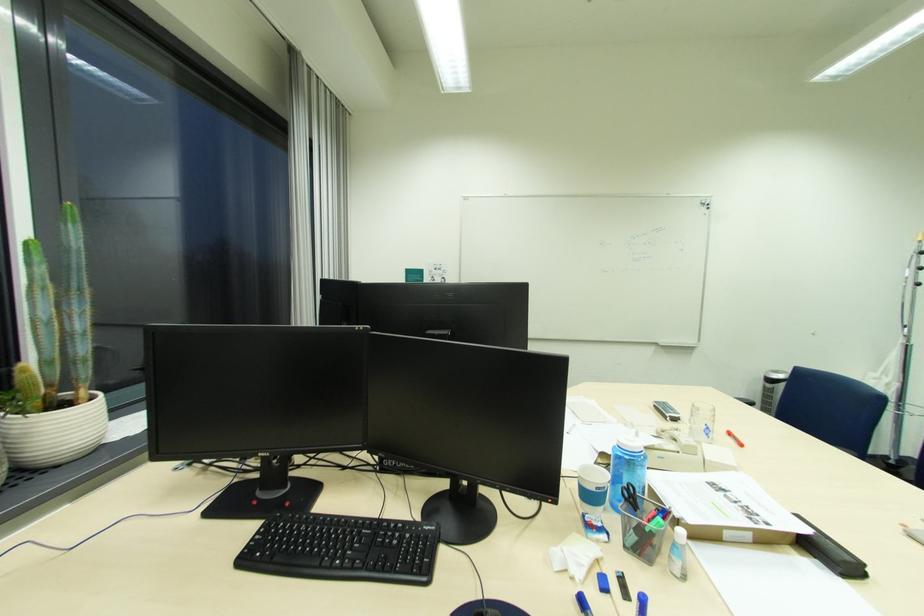
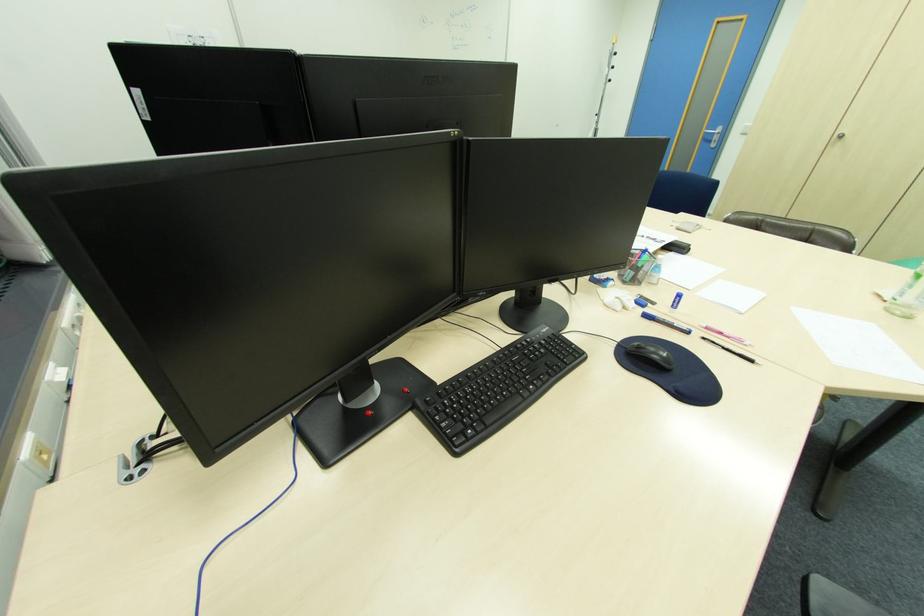
The images are taken continuously from a first-person perspective. In which direction is your viewpoint rotating?

The camera rotated toward right-down.